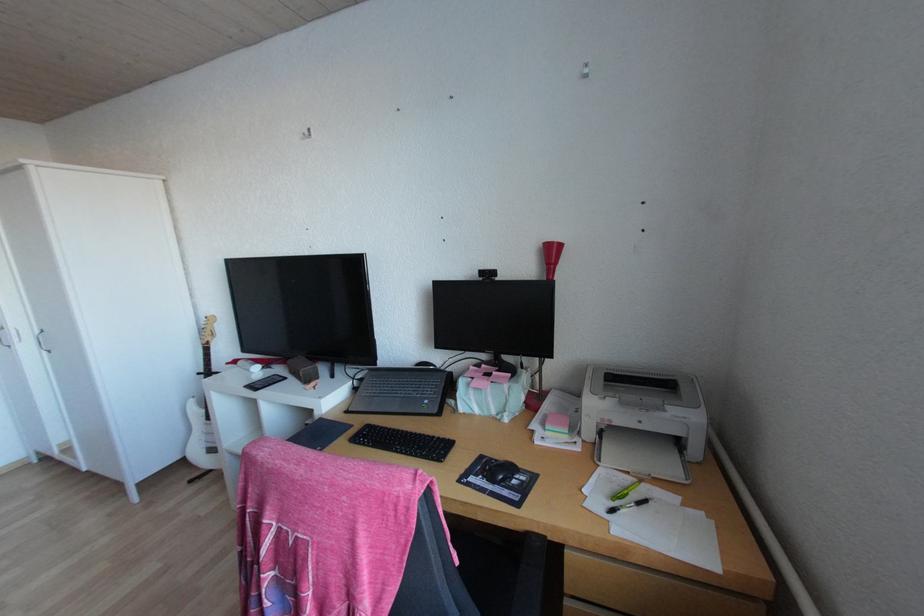
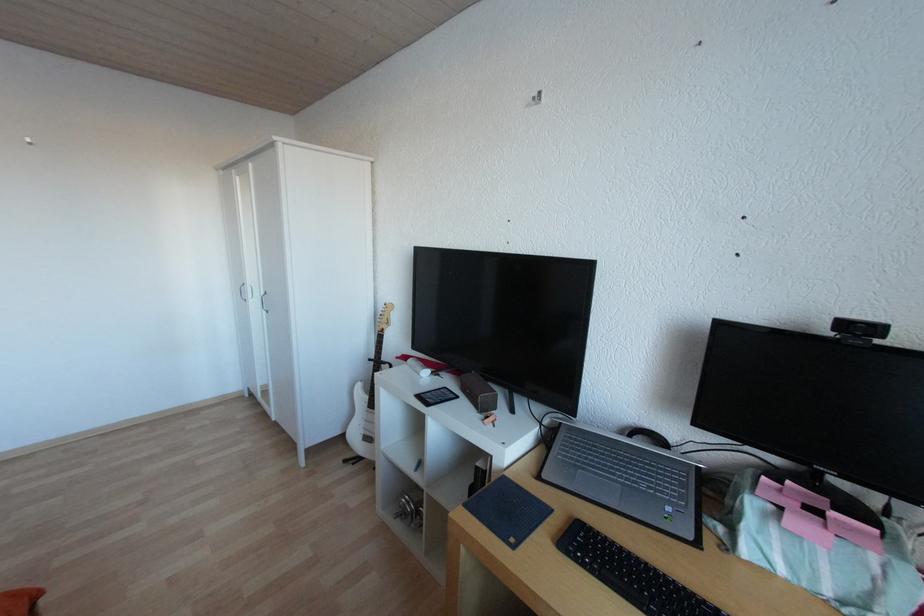
Which direction would the cameraman need to move to produce the second image?

The cameraman walked toward left, forward.